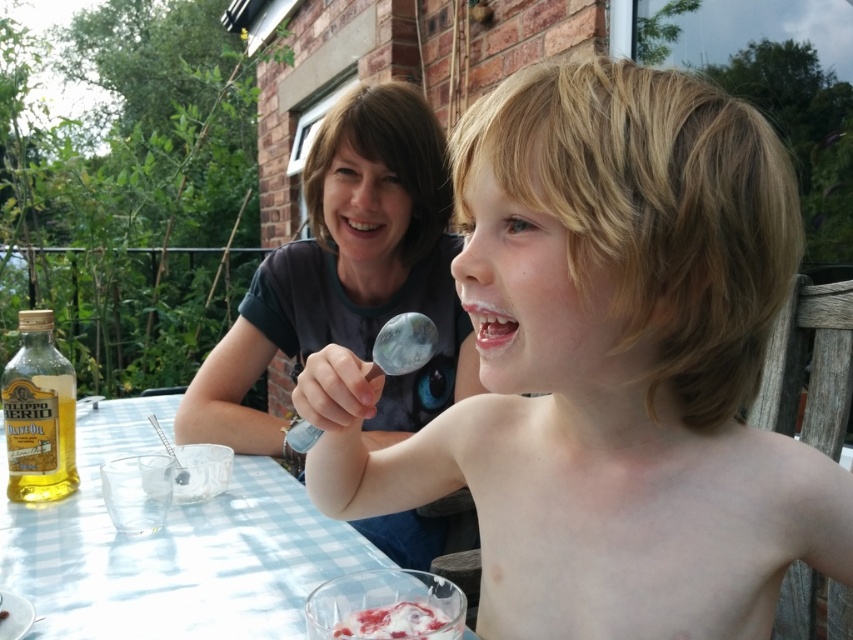
In the scene shown: You are a photographer taking a picture of the light blue checkered tablecloth at center and the white creamy dessert at lower center. Which object is closer to the camera?

The light blue checkered tablecloth at center is closer to the camera because the white creamy dessert at lower center is behind it.

You are standing in the garden looking at the scene. Where is the smooth blonde hair at center located in terms of coordinates?

The smooth blonde hair at center is located at coordinates point (x=608, y=365).

You are a photographer trying to capture a closeup of the white creamy dessert at lower center without the smooth blonde hair at center blocking the view. Can you move your camera position to achieve this?

The smooth blonde hair at center is closer to the viewer than the white creamy dessert at lower center, so moving the camera position might help but the hair could still block the dessert if they are on the same plane. However, since the hair is closer, moving the camera angle slightly downward or sideways might allow the dessert to come into view without obstruction.